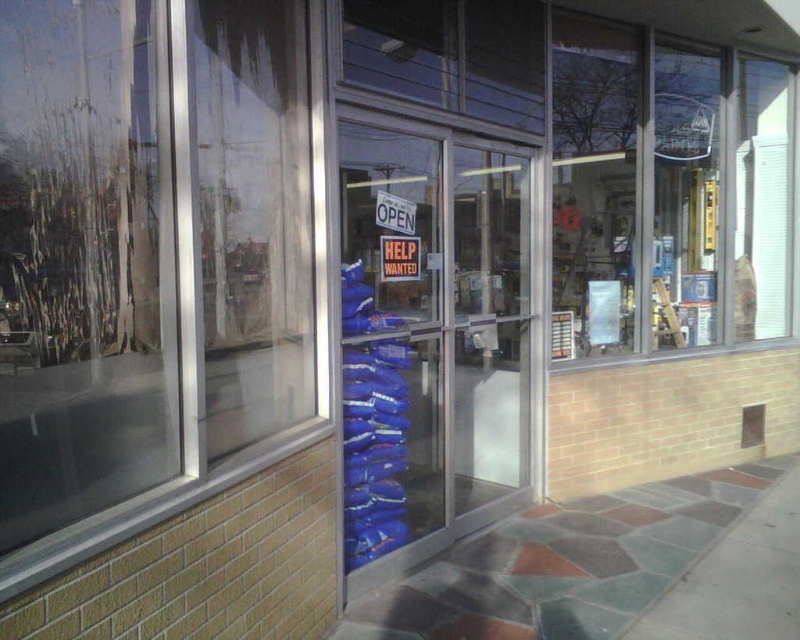
You are a customer trying to enter the store. You notice the transparent glass door at center and the red paper help wanted sign at center. Which object is wider when viewed from the outside?

The transparent glass door at center is wider than the red paper help wanted sign at center according to the description.

You are standing outside the store looking through the glass doors. There are two points marked on the glass doors at coordinates point [536,572] and point [388,266]. Which point is closer to you?

Point [388,266] is closer to you because it is less further to the camera than point [536,572].

You are standing outside the store and want to enter. The store has two points marked on its exterior. The first point is at coordinates point [130,28] and the second is at point [354,160]. Which point is closer to the entrance?

Point [130,28] is in front of point [354,160], so it is closer to the entrance.